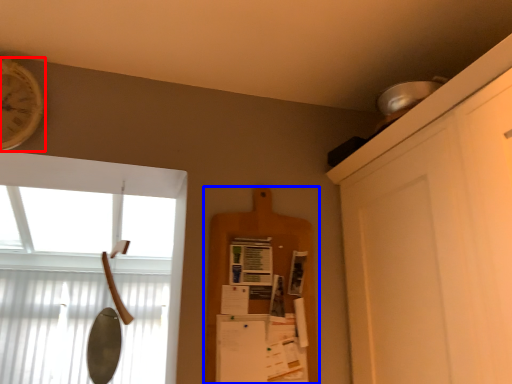
Question: Among these objects, which one is farthest to the camera, clock (highlighted by a red box) or shelf (highlighted by a blue box)?

Choices:
 (A) clock
 (B) shelf

Answer: (B)